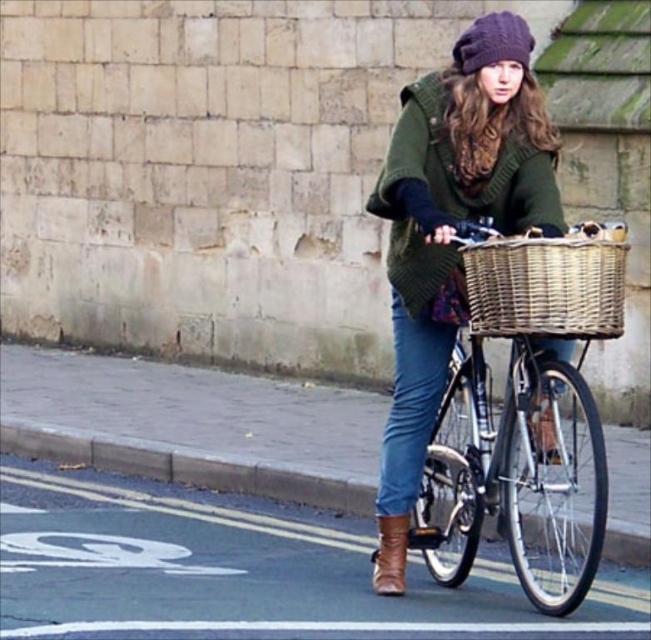
You are a delivery person trying to secure a package in the woven wicker basket at center. The package is as wide as the denim jeans at lower center. Will the package fit inside the basket?

The woven wicker basket at center might be wider than denim jeans at lower center, so the package should fit inside the basket since its width matches the jeans, and the basket is possibly wider.

You are standing at the point labeled point (506, 32) and want to walk to the point labeled point (409, 429). Which direction should you move in relation to the bicycle lane?

You should move forward along the bicycle lane because point (409, 429) is behind point (506, 32), meaning it is in the direction you are facing as you ride the bicycle.

You are a delivery person who needs to place a package in the matte wicker basket at center. According to the coordinates provided, where exactly should you position yourself to place the package into the basket?

The matte wicker basket at center is located at coordinates point (523, 417). Position yourself at that point to place the package into the basket.